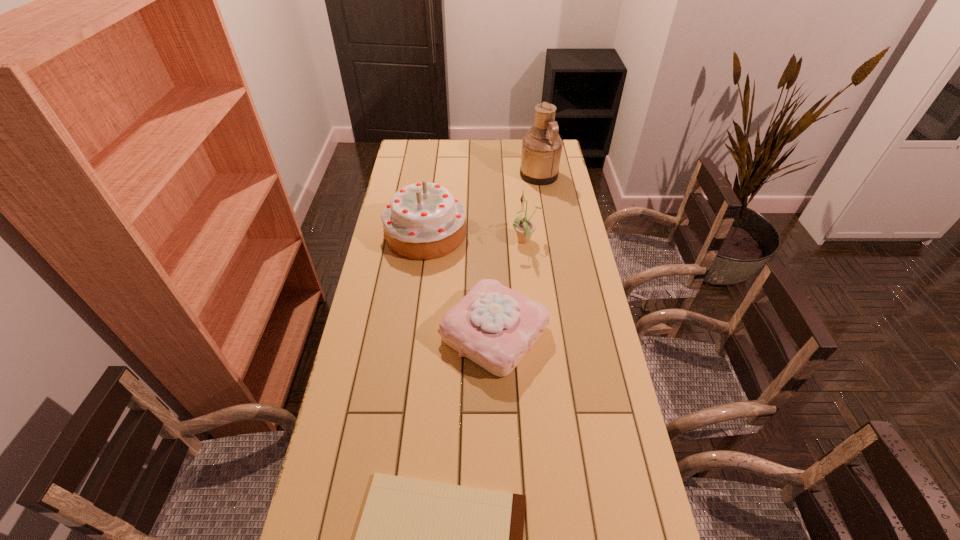
The image size is (960, 540). I want to click on free location that satisfies the following two spatial constraints: 1. on the front side of the second nearest object; 2. on the left side of the farther cake, so tap(413, 333).